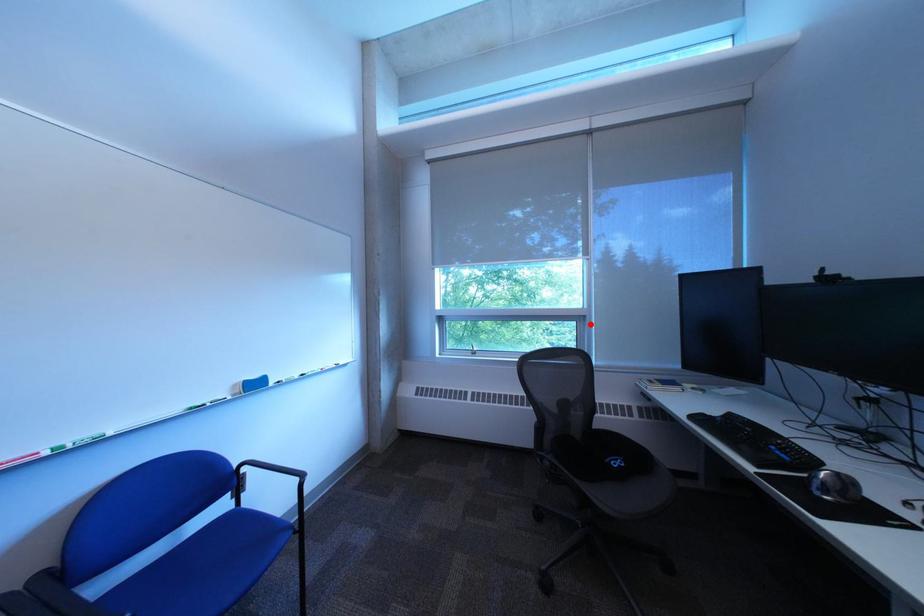
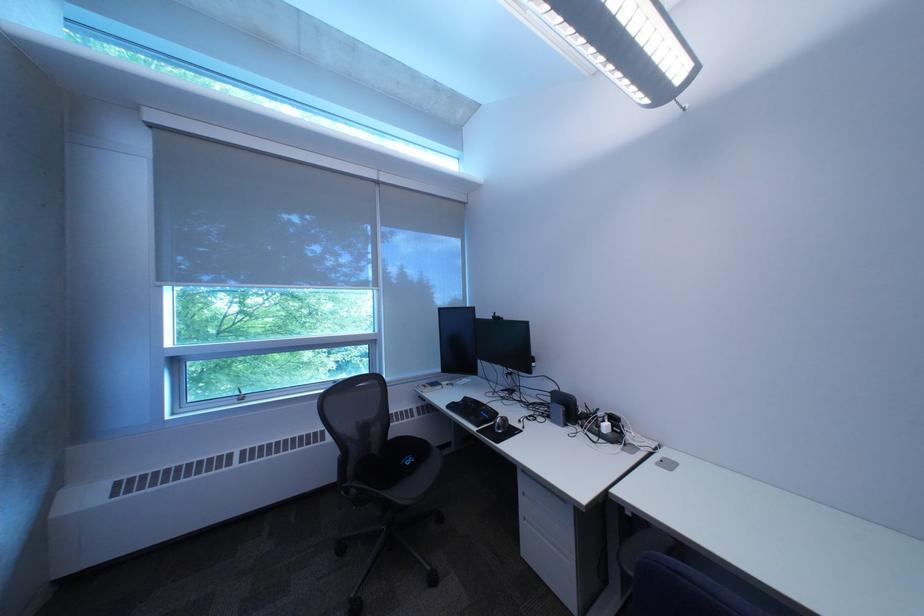
In the second image, find the point that corresponds to the highlighted location in the first image.

(383, 347)